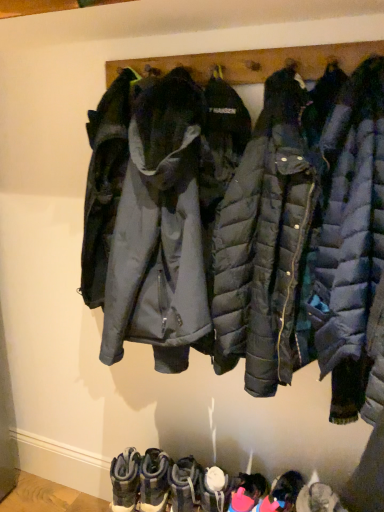
Image resolution: width=384 pixels, height=512 pixels. Describe the element at coordinates (283, 493) in the screenshot. I see `pink fabric boots at lower center, which is the 1th footwear from right to left` at that location.

You are a GUI agent. You are given a task and a screenshot of the screen. Output one action in this format:
    pyautogui.click(x=<x>, y=<y>)
    Task: Click on the white matte boot at lower center, the 4th footwear from the left
    The image size is (384, 512).
    Given the screenshot: What is the action you would take?
    pyautogui.click(x=214, y=489)

This screenshot has width=384, height=512. What do you see at coordinates (185, 485) in the screenshot?
I see `leather suede boots at lower center, which is the 3th footwear from left to right` at bounding box center [185, 485].

What is the approximate height of matte black puffer jacket at center?

The height of matte black puffer jacket at center is 1.14 meters.

Identify the location of pink fabric boots at lower center, arranged as the sixth footwear when viewed from the left. This screenshot has width=384, height=512. (283, 493).

Who is smaller, camouflage suede boots at lower center, which is the first footwear from left to right, or leather suede boots at lower center, which ranks as the fifth footwear in right-to-left order?

leather suede boots at lower center, which ranks as the fifth footwear in right-to-left order.

From a real-world perspective, is camouflage suede boots at lower center, positioned as the sixth footwear in right-to-left order, positioned under leather suede boots at lower center, which ranks as the fifth footwear in right-to-left order, based on gravity?

Actually, camouflage suede boots at lower center, positioned as the sixth footwear in right-to-left order, is physically above leather suede boots at lower center, which ranks as the fifth footwear in right-to-left order, in the real world.

Is leather suede boots at lower center, which is the 2th footwear in left-to-right order, at the back of camouflage suede boots at lower center, positioned as the sixth footwear in right-to-left order?

No, camouflage suede boots at lower center, positioned as the sixth footwear in right-to-left order, is not facing away from leather suede boots at lower center, which is the 2th footwear in left-to-right order.

Would you say camouflage suede boots at lower center, positioned as the sixth footwear in right-to-left order, is a long distance from leather suede boots at lower center, which ranks as the fifth footwear in right-to-left order?

camouflage suede boots at lower center, positioned as the sixth footwear in right-to-left order, is near leather suede boots at lower center, which ranks as the fifth footwear in right-to-left order, not far away.

Considering the relative sizes of matte black puffer jacket at center and white matte boot at lower center, the 4th footwear from the left, in the image provided, is matte black puffer jacket at center wider than white matte boot at lower center, the 4th footwear from the left,?

Correct, the width of matte black puffer jacket at center exceeds that of white matte boot at lower center, the 4th footwear from the left.

Consider the image. Is matte black puffer jacket at center bigger than white matte boot at lower center, the 4th footwear from the left?

Yes, matte black puffer jacket at center is bigger than white matte boot at lower center, the 4th footwear from the left.

Is the depth of leather suede boots at lower center, which is the 2th footwear in left-to-right order, less than that of pink fabric boots at lower center, arranged as the sixth footwear when viewed from the left?

No, leather suede boots at lower center, which is the 2th footwear in left-to-right order, is further to the viewer.

At what (x,y) coordinates should I click in order to perform the action: click on the 4th footwear to the left when counting from the pink fabric boots at lower center, arranged as the sixth footwear when viewed from the left. Please return your answer as a coordinate pair (x, y). The height and width of the screenshot is (512, 384). Looking at the image, I should click on (154, 481).

From a real-world perspective, is leather suede boots at lower center, which is the 2th footwear in left-to-right order, over pink fabric boots at lower center, which is the 1th footwear from right to left?

Yes, from a real-world perspective, leather suede boots at lower center, which is the 2th footwear in left-to-right order, is above pink fabric boots at lower center, which is the 1th footwear from right to left.

Are leather suede boots at lower center, which ranks as the fifth footwear in right-to-left order, and pink fabric boots at lower center, which is the 1th footwear from right to left, making contact?

No, leather suede boots at lower center, which ranks as the fifth footwear in right-to-left order, is not next to pink fabric boots at lower center, which is the 1th footwear from right to left.

How distant is camouflage suede boots at lower center, which is the first footwear from left to right, from pink fabric boot at lower center, positioned as the 5th footwear in left-to-right order?

camouflage suede boots at lower center, which is the first footwear from left to right, is 15.08 inches from pink fabric boot at lower center, positioned as the 5th footwear in left-to-right order.

Is pink fabric boot at lower center, positioned as the 5th footwear in left-to-right order, completely or partially inside camouflage suede boots at lower center, positioned as the sixth footwear in right-to-left order?

No, pink fabric boot at lower center, positioned as the 5th footwear in left-to-right order, is located outside of camouflage suede boots at lower center, positioned as the sixth footwear in right-to-left order.

Is camouflage suede boots at lower center, positioned as the sixth footwear in right-to-left order, to the right of pink fabric boot at lower center, positioned as the 5th footwear in left-to-right order, from the viewer's perspective?

No, camouflage suede boots at lower center, positioned as the sixth footwear in right-to-left order, is not to the right of pink fabric boot at lower center, positioned as the 5th footwear in left-to-right order.

Considering the positions of points (120, 494) and (247, 501), is point (120, 494) farther from camera compared to point (247, 501)?

Yes, it is behind point (247, 501).

Is leather suede boots at lower center, the fourth footwear from the right, further to camera compared to white matte boot at lower center, which is counted as the third footwear, starting from the right?

That is True.

Which is more distant, (188,486) or (216,472)?

The point (188,486) is farther.

From the image's perspective, relative to white matte boot at lower center, which is counted as the third footwear, starting from the right, is leather suede boots at lower center, the fourth footwear from the right, above or below?

Clearly, from the image's perspective, leather suede boots at lower center, the fourth footwear from the right, is below white matte boot at lower center, which is counted as the third footwear, starting from the right.

From a real-world perspective, is leather suede boots at lower center, which is the 3th footwear from left to right, physically above white matte boot at lower center, the 4th footwear from the left?

No, from a real-world perspective, leather suede boots at lower center, which is the 3th footwear from left to right, is not over white matte boot at lower center, the 4th footwear from the left

From a real-world perspective, is leather suede boots at lower center, which is the 3th footwear from left to right, above or below leather suede boots at lower center, which ranks as the fifth footwear in right-to-left order?

leather suede boots at lower center, which is the 3th footwear from left to right, is above leather suede boots at lower center, which ranks as the fifth footwear in right-to-left order.

Looking at their sizes, would you say leather suede boots at lower center, the fourth footwear from the right, is wider or thinner than leather suede boots at lower center, which is the 2th footwear in left-to-right order?

Considering their sizes, leather suede boots at lower center, the fourth footwear from the right, looks broader than leather suede boots at lower center, which is the 2th footwear in left-to-right order.

At what (x,y) coordinates should I click in order to perform the action: click on the 1st footwear to the left when counting from the leather suede boots at lower center, which is the 3th footwear from left to right. Please return your answer as a coordinate pair (x, y). This screenshot has height=512, width=384. Looking at the image, I should click on (154, 481).

Is leather suede boots at lower center, which ranks as the fifth footwear in right-to-left order, to the left or to the right of matte black puffer jacket at center in the image?

Clearly, leather suede boots at lower center, which ranks as the fifth footwear in right-to-left order, is on the left of matte black puffer jacket at center in the image.

From the image's perspective, which is above, leather suede boots at lower center, which ranks as the fifth footwear in right-to-left order, or matte black puffer jacket at center?

matte black puffer jacket at center appears higher in the image.

In the image, is leather suede boots at lower center, which is the 2th footwear in left-to-right order, positioned in front of or behind matte black puffer jacket at center?

leather suede boots at lower center, which is the 2th footwear in left-to-right order, is positioned farther from the viewer than matte black puffer jacket at center.

Where is `footwear that is above the leather suede boots at lower center, which ranks as the fifth footwear in right-to-left order (from the image's perspective)`? Image resolution: width=384 pixels, height=512 pixels. footwear that is above the leather suede boots at lower center, which ranks as the fifth footwear in right-to-left order (from the image's perspective) is located at coordinates (125, 480).

Image resolution: width=384 pixels, height=512 pixels. Identify the location of the 2nd footwear to the left when counting from the matte black puffer jacket at center. pyautogui.click(x=214, y=489).

From the image, which object appears to be nearer to camouflage suede boots at lower center, positioned as the sixth footwear in right-to-left order, pink fabric boots at lower center, arranged as the sixth footwear when viewed from the left, or white matte boot at lower center, which is counted as the third footwear, starting from the right?

The object closer to camouflage suede boots at lower center, positioned as the sixth footwear in right-to-left order, is white matte boot at lower center, which is counted as the third footwear, starting from the right.

Looking at this image, when comparing their distances from pink fabric boots at lower center, which is the 1th footwear from right to left, does white matte boot at lower center, which is counted as the third footwear, starting from the right, or leather suede boots at lower center, which ranks as the fifth footwear in right-to-left order, seem closer?

Among the two, white matte boot at lower center, which is counted as the third footwear, starting from the right, is located nearer to pink fabric boots at lower center, which is the 1th footwear from right to left.

Based on their spatial positions, is matte black puffer jacket at center or pink fabric boots at lower center, which is the 1th footwear from right to left, further from leather suede boots at lower center, which ranks as the fifth footwear in right-to-left order?

Among the two, matte black puffer jacket at center is located further to leather suede boots at lower center, which ranks as the fifth footwear in right-to-left order.

From the image, which object appears to be nearer to leather suede boots at lower center, the fourth footwear from the right, matte black puffer jacket at center or camouflage suede boots at lower center, positioned as the sixth footwear in right-to-left order?

camouflage suede boots at lower center, positioned as the sixth footwear in right-to-left order, lies closer to leather suede boots at lower center, the fourth footwear from the right, than the other object.

Considering their positions, is camouflage suede boots at lower center, positioned as the sixth footwear in right-to-left order, positioned closer to leather suede boots at lower center, which is the 3th footwear from left to right, than white matte boot at lower center, which is counted as the third footwear, starting from the right?

The object closer to leather suede boots at lower center, which is the 3th footwear from left to right, is white matte boot at lower center, which is counted as the third footwear, starting from the right.

Looking at the image, which one is located closer to leather suede boots at lower center, the fourth footwear from the right, pink fabric boot at lower center, which ranks as the second footwear in right-to-left order, or leather suede boots at lower center, which is the 2th footwear in left-to-right order?

Among the two, leather suede boots at lower center, which is the 2th footwear in left-to-right order, is located nearer to leather suede boots at lower center, the fourth footwear from the right.

Estimate the real-world distances between objects in this image. Which object is further from matte black puffer jacket at center, leather suede boots at lower center, which is the 3th footwear from left to right, or pink fabric boots at lower center, which is the 1th footwear from right to left?

leather suede boots at lower center, which is the 3th footwear from left to right, lies further to matte black puffer jacket at center than the other object.

Looking at the image, which one is located closer to pink fabric boot at lower center, which ranks as the second footwear in right-to-left order, pink fabric boots at lower center, arranged as the sixth footwear when viewed from the left, or white matte boot at lower center, the 4th footwear from the left?

The object closer to pink fabric boot at lower center, which ranks as the second footwear in right-to-left order, is pink fabric boots at lower center, arranged as the sixth footwear when viewed from the left.

You are a GUI agent. You are given a task and a screenshot of the screen. Output one action in this format:
    pyautogui.click(x=<x>, y=<y>)
    Task: Click on the footwear between matte black puffer jacket at center and leather suede boots at lower center, which is the 2th footwear in left-to-right order, in the vertical direction
    
    Given the screenshot: What is the action you would take?
    pyautogui.click(x=125, y=480)

The image size is (384, 512). What are the coordinates of `footwear between leather suede boots at lower center, which ranks as the fifth footwear in right-to-left order, and white matte boot at lower center, the 4th footwear from the left` in the screenshot? It's located at (185, 485).

This screenshot has width=384, height=512. I want to click on footwear situated between white matte boot at lower center, which is counted as the third footwear, starting from the right, and pink fabric boots at lower center, which is the 1th footwear from right to left, from left to right, so click(x=248, y=492).

You are a GUI agent. You are given a task and a screenshot of the screen. Output one action in this format:
    pyautogui.click(x=<x>, y=<y>)
    Task: Click on the footwear between camouflage suede boots at lower center, positioned as the sixth footwear in right-to-left order, and leather suede boots at lower center, the fourth footwear from the right, from left to right
    The width and height of the screenshot is (384, 512).
    Given the screenshot: What is the action you would take?
    pyautogui.click(x=154, y=481)